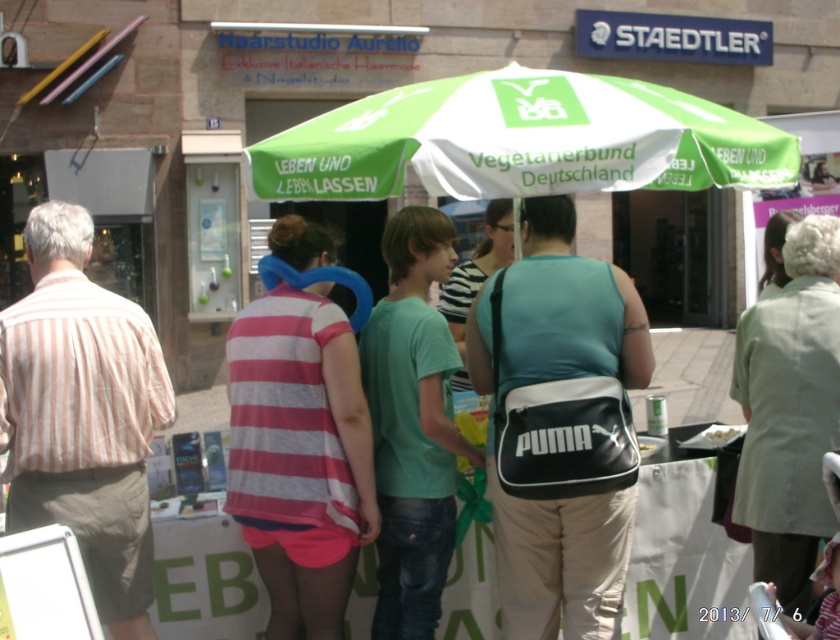
Who is positioned more to the right, green fabric umbrella at center or white crumbly food at center?

white crumbly food at center is more to the right.

Is point (633, 157) less distant than point (704, 432)?

Yes, it is.

Find the location of `green fabric umbrella at center`. green fabric umbrella at center is located at coordinates (520, 140).

Does point (599, 544) lie behind point (725, 426)?

No, it is in front of (725, 426).

Is point (609, 625) positioned behind point (735, 426)?

That is False.

This screenshot has height=640, width=840. In order to click on black synthetic bag at center in this screenshot , I will do pos(557,312).

What do you see at coordinates (82, 413) in the screenshot?
I see `striped cotton shirt at left` at bounding box center [82, 413].

You are a GUI agent. You are given a task and a screenshot of the screen. Output one action in this format:
    pyautogui.click(x=<x>, y=<y>)
    Task: Click on the striped cotton shirt at left
    Image resolution: width=840 pixels, height=640 pixels.
    Given the screenshot: What is the action you would take?
    pyautogui.click(x=82, y=413)

Between point (126, 525) and point (510, 298), which one is positioned in front?

Positioned in front is point (126, 525).

The width and height of the screenshot is (840, 640). Find the location of `striped cotton shirt at left`. striped cotton shirt at left is located at coordinates (82, 413).